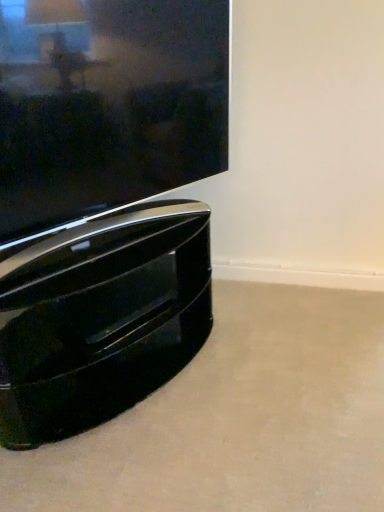
Identify the location of free space above glossy black tv stand at lower left (from a real-world perspective). (105, 240).